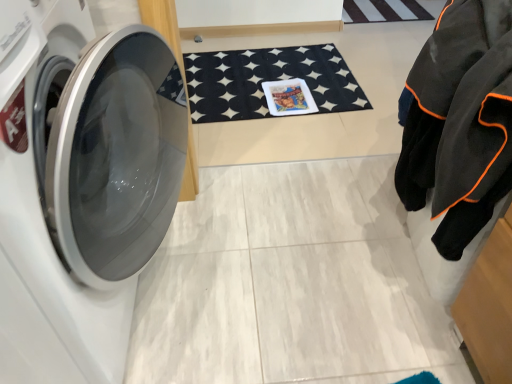
Question: From the image's perspective, is black felt bath mat at center above or below black fleece jacket at right?

Choices:
 (A) below
 (B) above

Answer: (B)

Question: In terms of size, does black felt bath mat at center appear bigger or smaller than black fleece jacket at right?

Choices:
 (A) big
 (B) small

Answer: (B)

Question: Which of these objects is positioned farthest from the black fleece jacket at right?

Choices:
 (A) black felt bath mat at center
 (B) white glossy washing machine at left

Answer: (A)

Question: Which of these objects is positioned closest to the white glossy washing machine at left?

Choices:
 (A) black fleece jacket at right
 (B) black felt bath mat at center

Answer: (A)